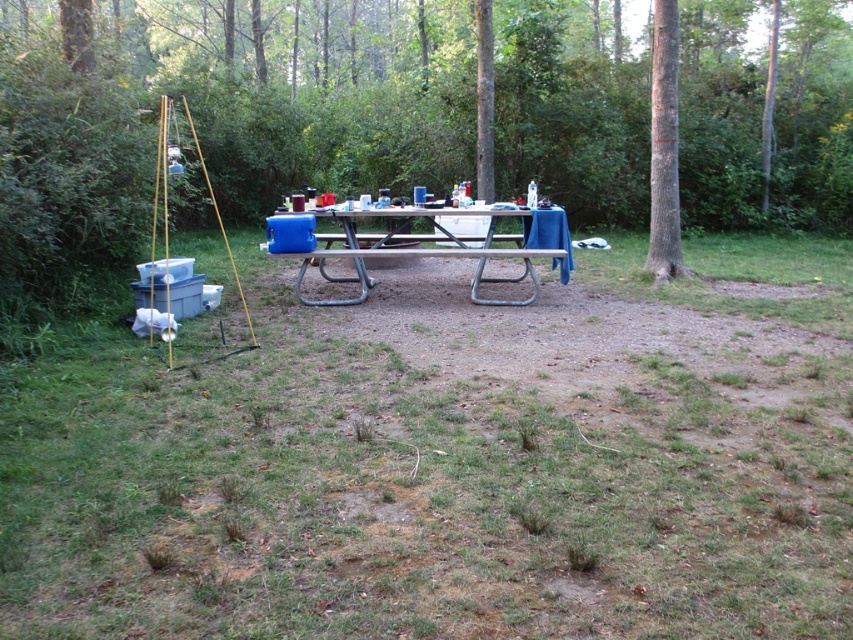
Question: Does white plastic table at center appear on the left side of smooth gray bark at right?

Choices:
 (A) no
 (B) yes

Answer: (B)

Question: Observing the image, what is the correct spatial positioning of white plastic table at center in reference to smooth gray bark at right?

Choices:
 (A) above
 (B) below

Answer: (B)

Question: Does white plastic table at center have a larger size compared to smooth gray bark at right?

Choices:
 (A) yes
 (B) no

Answer: (A)

Question: Which point is farther to the camera?

Choices:
 (A) (656, 250)
 (B) (344, 253)

Answer: (A)

Question: Which object is closer to the camera taking this photo?

Choices:
 (A) white plastic table at center
 (B) smooth gray bark at right

Answer: (A)